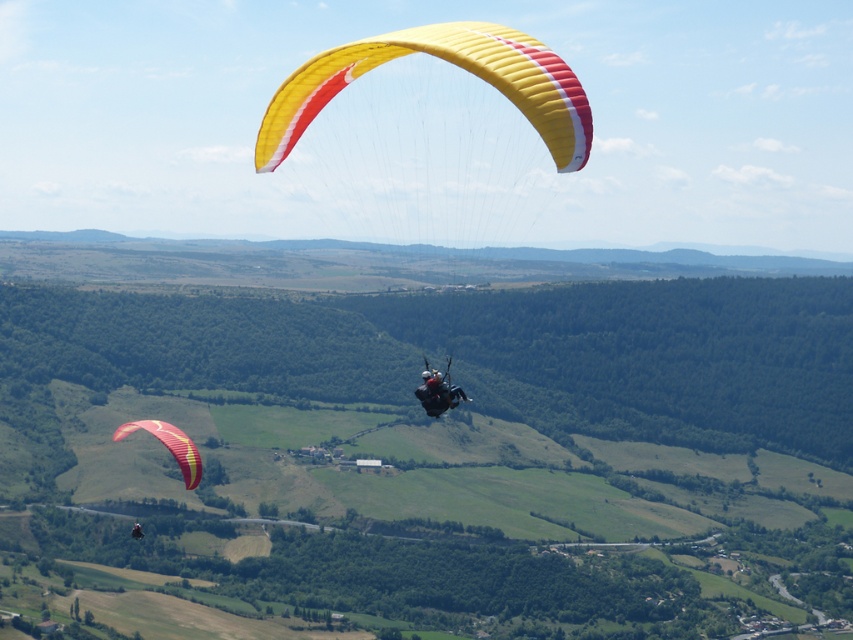
You are a pilot in the yellow fabric parachute at lower left and want to catch up with the black fabric paraglider at upper center. Which direction should you adjust your flight to get closer to it?

The yellow fabric parachute at lower left is further to the viewer than the black fabric paraglider at upper center, so you should ascend higher to reduce the distance between them.

You are a pilot observing two paragliders in the sky. You see the yellow fabric parachute at center and the black fabric paraglider at upper center. Which one is lower in the sky?

The yellow fabric parachute at center is lower in the sky than the black fabric paraglider at upper center because it has a lesser height compared to it.

You are a pilot in the yellow fabric parachute at center. You want to land safely near the yellow fabric parachute at lower left. Is it possible to land directly above it?

The yellow fabric parachute at center is positioned over yellow fabric parachute at lower left, so yes, you can land directly above it.